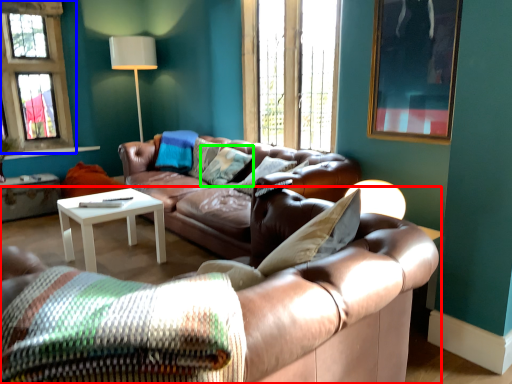
Question: Which object is positioned farthest from studio couch (highlighted by a red box)? Select from window (highlighted by a blue box) and pillow (highlighted by a green box).

Choices:
 (A) window
 (B) pillow

Answer: (A)